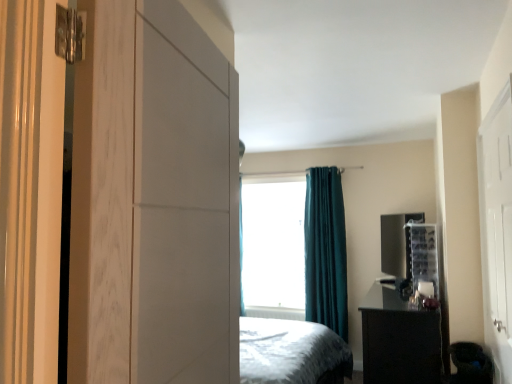
Question: Can you confirm if black glossy nightstand at lower right is positioned to the left of white matte cabinet at left?

Choices:
 (A) yes
 (B) no

Answer: (B)

Question: Is black glossy nightstand at lower right behind white matte cabinet at left?

Choices:
 (A) no
 (B) yes

Answer: (B)

Question: From a real-world perspective, does black glossy nightstand at lower right sit lower than white matte cabinet at left?

Choices:
 (A) yes
 (B) no

Answer: (A)

Question: Does black glossy nightstand at lower right have a greater height compared to white matte cabinet at left?

Choices:
 (A) yes
 (B) no

Answer: (B)

Question: Considering the relative sizes of black glossy nightstand at lower right and white matte cabinet at left in the image provided, is black glossy nightstand at lower right shorter than white matte cabinet at left?

Choices:
 (A) yes
 (B) no

Answer: (A)

Question: In the image, is black glossy nightstand at lower right positioned in front of or behind teal velvet curtain at center?

Choices:
 (A) behind
 (B) front

Answer: (B)

Question: Looking at the image, does black glossy nightstand at lower right seem bigger or smaller compared to teal velvet curtain at center?

Choices:
 (A) big
 (B) small

Answer: (A)

Question: Considering the positions of point (380, 294) and point (322, 322), is point (380, 294) closer or farther from the camera than point (322, 322)?

Choices:
 (A) closer
 (B) farther

Answer: (A)

Question: From a real-world perspective, is black glossy nightstand at lower right positioned above or below teal velvet curtain at center?

Choices:
 (A) below
 (B) above

Answer: (A)

Question: Would you say white matte cabinet at left is inside or outside white glossy door at right?

Choices:
 (A) outside
 (B) inside

Answer: (A)

Question: Considering the positions of white matte cabinet at left and white glossy door at right in the image, is white matte cabinet at left wider or thinner than white glossy door at right?

Choices:
 (A) thin
 (B) wide

Answer: (B)

Question: From the image's perspective, is white matte cabinet at left positioned above or below white glossy door at right?

Choices:
 (A) below
 (B) above

Answer: (B)

Question: Is white matte cabinet at left taller or shorter than white glossy door at right?

Choices:
 (A) tall
 (B) short

Answer: (B)

Question: Looking at their shapes, would you say white glossy door at right is wider or thinner than white matte cabinet at left?

Choices:
 (A) thin
 (B) wide

Answer: (A)

Question: Is point (509, 256) positioned closer to the camera than point (189, 269)?

Choices:
 (A) closer
 (B) farther

Answer: (B)